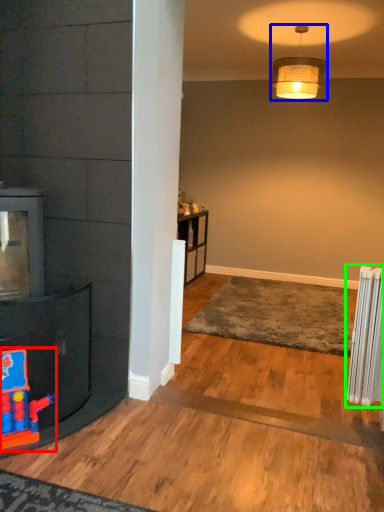
Question: Which object is positioned farthest from toy (highlighted by a red box)? Select from lamp (highlighted by a blue box) and radiator (highlighted by a green box).

Choices:
 (A) lamp
 (B) radiator

Answer: (A)